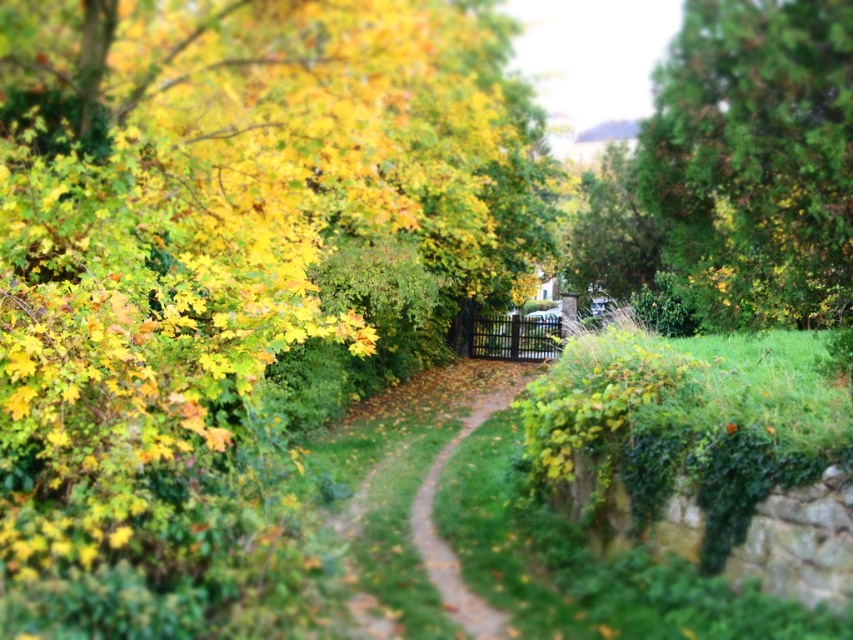
Question: Is the position of green textured tree at upper right less distant than that of green grassy trail at center?

Choices:
 (A) yes
 (B) no

Answer: (B)

Question: Is green textured tree at upper right further to the viewer compared to green grassy trail at center?

Choices:
 (A) yes
 (B) no

Answer: (A)

Question: Which point is closer to the camera?

Choices:
 (A) green textured tree at upper right
 (B) green grassy trail at center

Answer: (B)

Question: Which of the following is the farthest from the observer?

Choices:
 (A) green grassy trail at center
 (B) green textured tree at upper right

Answer: (B)

Question: Does green textured tree at upper right come in front of green grassy trail at center?

Choices:
 (A) yes
 (B) no

Answer: (B)

Question: Which of the following is the closest to the observer?

Choices:
 (A) (482, 609)
 (B) (724, 204)

Answer: (A)